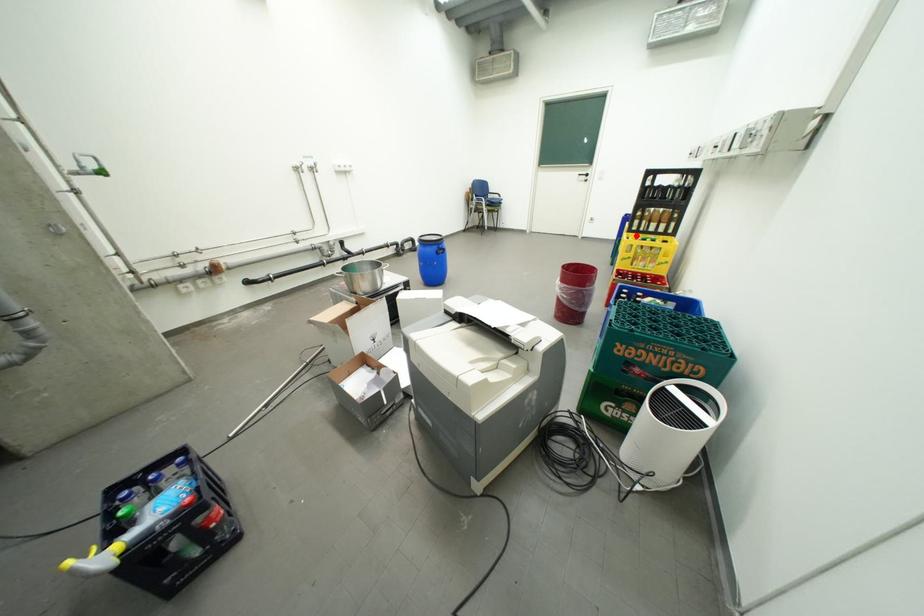
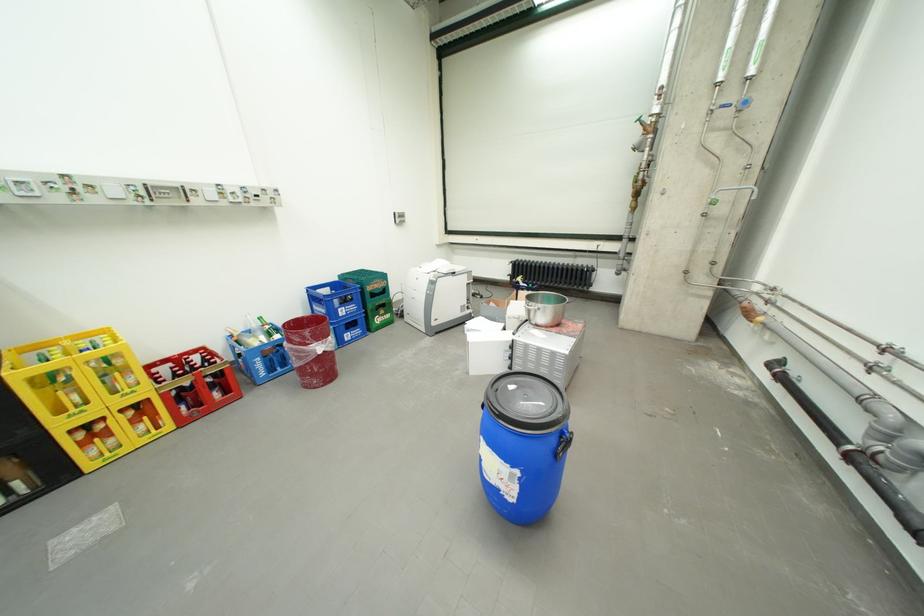
Locate, in the second image, the point that corresponds to the highlighted location in the first image.

(30, 374)